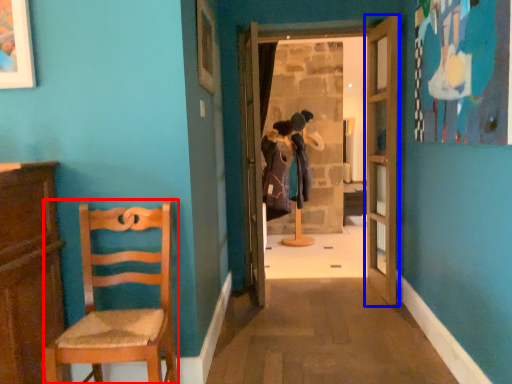
Question: Which of the following is the closest to the observer, chair (highlighted by a red box) or door (highlighted by a blue box)?

Choices:
 (A) chair
 (B) door

Answer: (A)